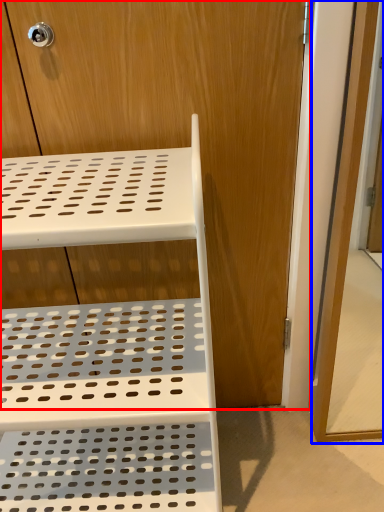
Question: Among these objects, which one is nearest to the camera, dresser (highlighted by a red box) or screen door (highlighted by a blue box)?

Choices:
 (A) dresser
 (B) screen door

Answer: (B)